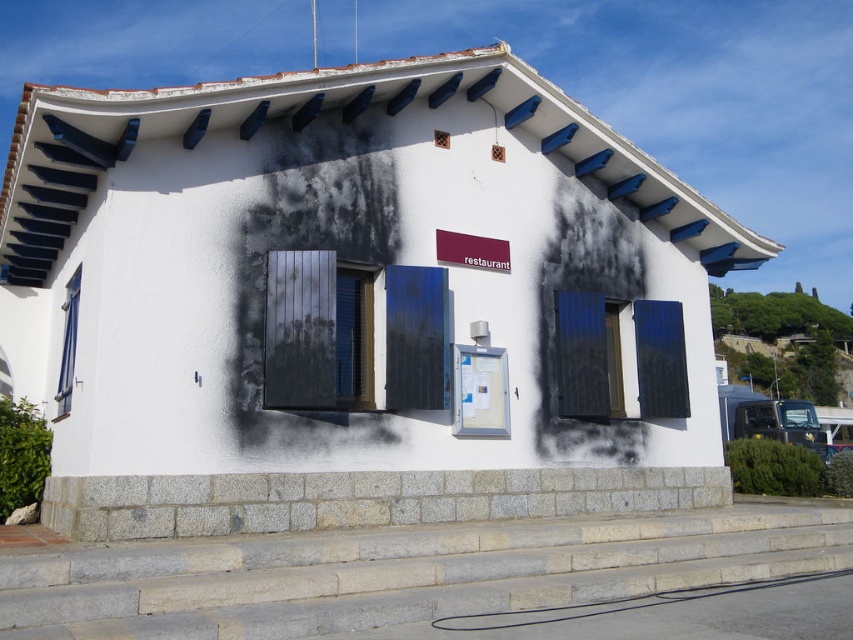
Question: Can you confirm if matte black window at center is thinner than blue matte shutter at center?

Choices:
 (A) yes
 (B) no

Answer: (B)

Question: Which object appears farthest from the camera in this image?

Choices:
 (A) black matte shutter at right
 (B) matte wood shutter at center
 (C) smooth stone stairs at center
 (D) matte black shutter at center

Answer: (A)

Question: Which object appears farthest from the camera in this image?

Choices:
 (A) matte wood shutter at center
 (B) smooth stone stairs at center

Answer: (A)

Question: Does smooth stone stairs at center have a smaller size compared to blue matte shutter at center?

Choices:
 (A) yes
 (B) no

Answer: (B)

Question: Does matte black window at center have a lesser width compared to matte black shutter at center?

Choices:
 (A) yes
 (B) no

Answer: (B)

Question: Considering the real-world distances, which object is closest to the matte black shutter at center?

Choices:
 (A) matte wood window at left
 (B) blue matte shutter at center
 (C) matte wood shutter at center
 (D) black matte shutter at right

Answer: (B)